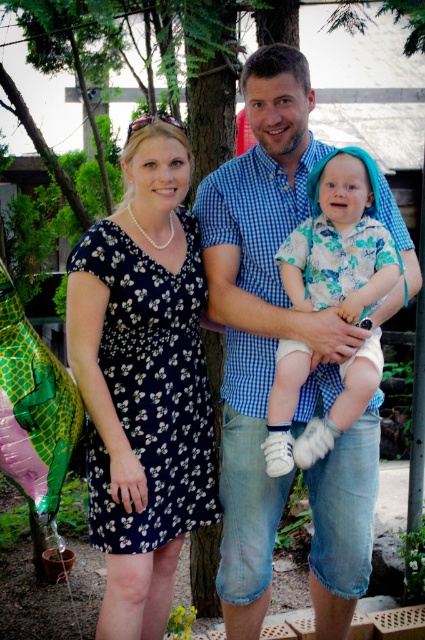
You are standing at the point marked by the coordinate point at [255,218]. You want to walk to the other side of the garden. The garden is 4 meters wide. Will you be able to reach the other side without crossing the garden?

The distance between you and the other side of the garden is 3.73 meters, which is less than the garden width of 4 meters. Therefore, you can reach the other side without crossing the entire garden.

You are organizing a photoshoot and need to place two outfits side by side. The black floral dress at left and the floral fabric shirt at center are both part of the collection. Based on the image, which outfit should you choose if you want the one that appears wider to highlight its design?

The black floral dress at left should be chosen because it might be wider than the floral fabric shirt at center, making it better for showcasing its design.

You are trying to decide which shirt to wear for a casual gathering. Based on the image, which shirt is taller between the blue checkered shirt at center and the floral fabric shirt at center?

The blue checkered shirt at center is much taller than the floral fabric shirt at center according to the image description.